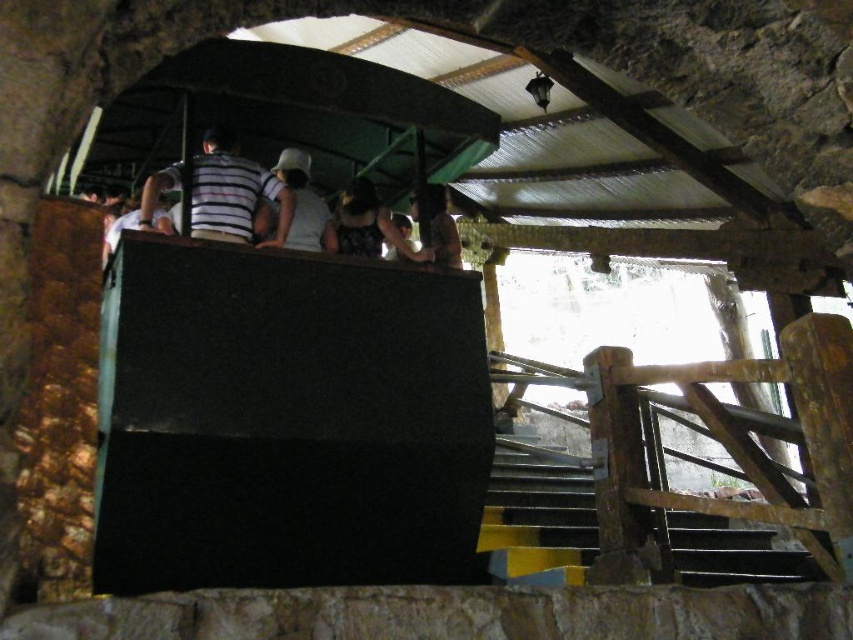
Can you confirm if dark brown leather jacket at upper center is positioned to the left of matte black shirt at upper center?

Correct, you'll find dark brown leather jacket at upper center to the left of matte black shirt at upper center.

Does dark brown leather jacket at upper center have a smaller size compared to matte black shirt at upper center?

Indeed, dark brown leather jacket at upper center has a smaller size compared to matte black shirt at upper center.

Is point (390, 225) farther from viewer compared to point (426, 182)?

No, (390, 225) is in front of (426, 182).

Find the location of a particular element. Image resolution: width=853 pixels, height=640 pixels. dark brown leather jacket at upper center is located at coordinates (369, 225).

Does metallic gray stairs at lower right have a greater width compared to dark brown leather jacket at upper center?

Yes.

Between metallic gray stairs at lower right and dark brown leather jacket at upper center, which one has less height?

metallic gray stairs at lower right is shorter.

Which is in front, point (718, 536) or point (339, 220)?

Point (339, 220) is in front.

What are the coordinates of `metallic gray stairs at lower right` in the screenshot? It's located at (538, 518).

In the scene shown: How much distance is there between metallic gray stairs at lower right and striped fabric shirt at upper center?

They are 8.37 feet apart.

Which is above, metallic gray stairs at lower right or striped fabric shirt at upper center?

striped fabric shirt at upper center is higher up.

Measure the distance between metallic gray stairs at lower right and camera.

The distance of metallic gray stairs at lower right from camera is 4.13 meters.

The image size is (853, 640). Find the location of `metallic gray stairs at lower right`. metallic gray stairs at lower right is located at coordinates click(x=538, y=518).